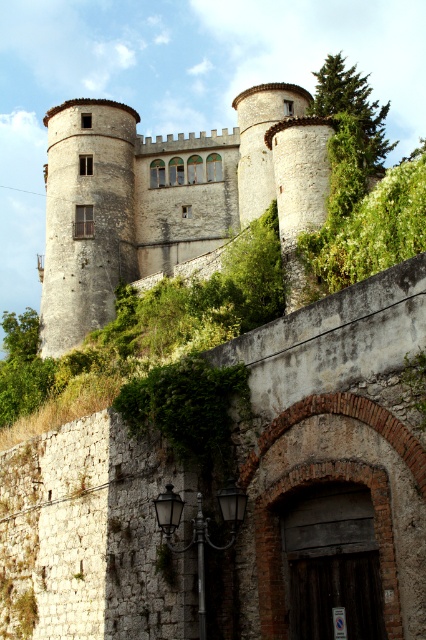
Question: Is white stone castle at center bigger than green leafy bush at upper right?

Choices:
 (A) no
 (B) yes

Answer: (A)

Question: Which of the following is the closest to the observer?

Choices:
 (A) (339, 288)
 (B) (123, 166)

Answer: (A)

Question: Can you confirm if white stone castle at center is positioned below green leafy bush at upper right?

Choices:
 (A) yes
 (B) no

Answer: (A)

Question: From the image, what is the correct spatial relationship of white stone castle at center in relation to green leafy bush at upper right?

Choices:
 (A) right
 (B) left

Answer: (B)